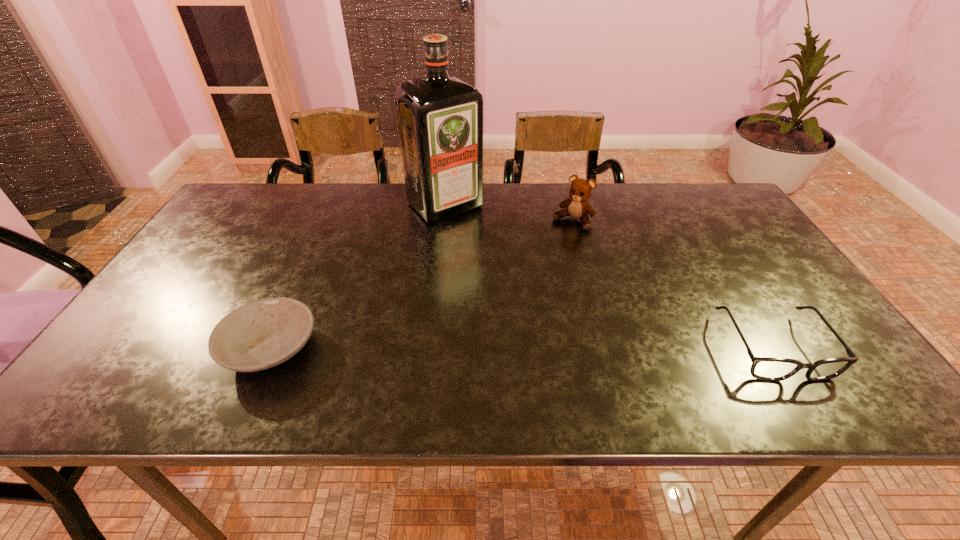
Locate an element on the screen. Image resolution: width=960 pixels, height=540 pixels. vacant point located between the third object from right to left and the leftmost object is located at coordinates (358, 277).

The height and width of the screenshot is (540, 960). I want to click on empty space that is in between the leftmost object and the tallest object, so click(358, 277).

The height and width of the screenshot is (540, 960). Find the location of `vacant space that is in between the second object from right to left and the second object from left to right`. vacant space that is in between the second object from right to left and the second object from left to right is located at coordinates (509, 213).

In order to click on free space between the bowl and the liquor in this screenshot , I will do `click(358, 277)`.

This screenshot has width=960, height=540. Find the location of `object that is the third closest one to the bowl`. object that is the third closest one to the bowl is located at coordinates (763, 368).

Image resolution: width=960 pixels, height=540 pixels. Find the location of `the second closest object to the spectacles`. the second closest object to the spectacles is located at coordinates (440, 118).

In order to click on vacant area in the image that satisfies the following two spatial constraints: 1. on the back side of the teddy bear; 2. on the left side of the bowl in this screenshot , I will do `click(327, 221)`.